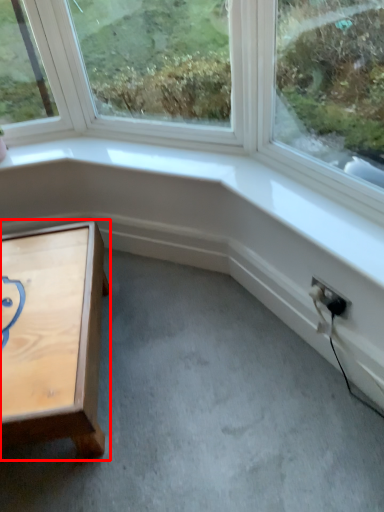
Question: From the image, what is the correct spatial relationship of table (annotated by the red box) in relation to electric outlet?

Choices:
 (A) left
 (B) right

Answer: (A)